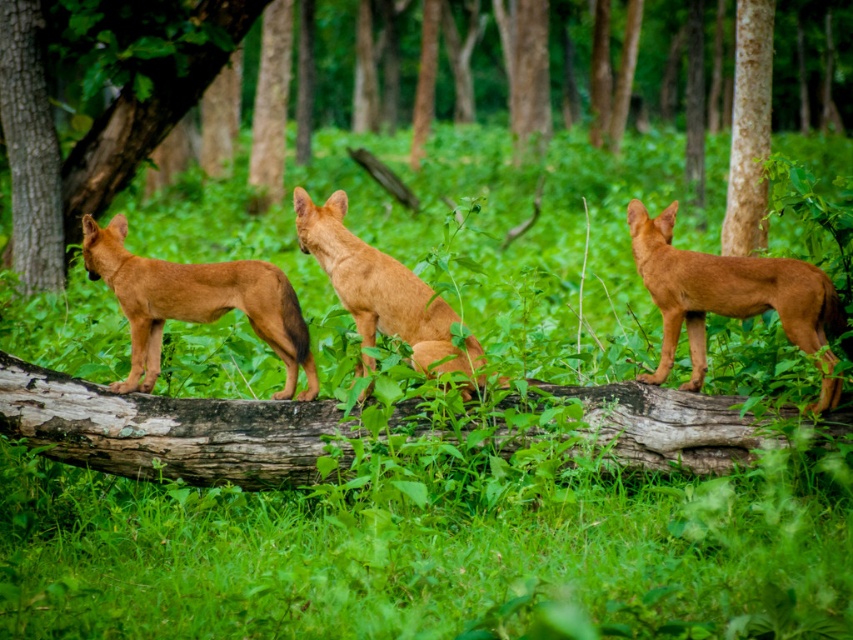
Question: Is brown furry dog at center closer to camera compared to brown rough tree trunk at left?

Choices:
 (A) no
 (B) yes

Answer: (B)

Question: Is brown wood tree at left positioned behind brown matte dog at center?

Choices:
 (A) no
 (B) yes

Answer: (B)

Question: Which point is farther to the camera?

Choices:
 (A) (22, 209)
 (B) (740, 13)
 (C) (642, 237)

Answer: (A)

Question: Can you confirm if green rough bark tree at left is positioned below brown furry dog at center?

Choices:
 (A) yes
 (B) no

Answer: (B)

Question: Among these objects, which one is nearest to the camera?

Choices:
 (A) brown matte dog at center
 (B) brown wood tree at left

Answer: (A)

Question: Among these objects, which one is farthest from the camera?

Choices:
 (A) brown furry dog at left
 (B) weathered wood log at center
 (C) brown rough bark at right
 (D) brown rough tree trunk at left

Answer: (D)